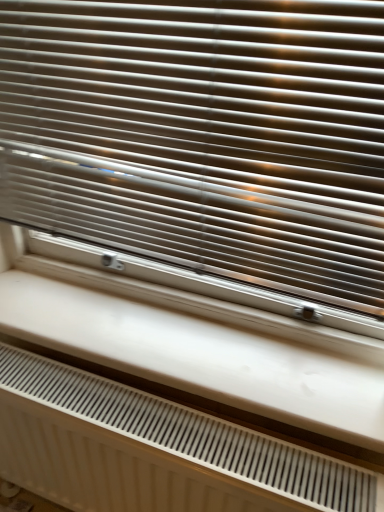
Looking at this image, measure the distance between white matte radiator at bottom and camera.

They are 24.77 inches apart.

What do you see at coordinates (152, 450) in the screenshot?
I see `white matte radiator at bottom` at bounding box center [152, 450].

The height and width of the screenshot is (512, 384). In order to click on white matte radiator at bottom in this screenshot , I will do `click(152, 450)`.

Find the location of `white matte radiator at bottom`. white matte radiator at bottom is located at coordinates (152, 450).